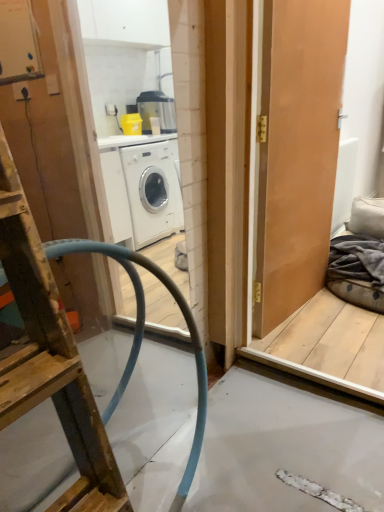
This screenshot has width=384, height=512. Find the location of `free location in front of matte wooden door at right`. free location in front of matte wooden door at right is located at coordinates (321, 337).